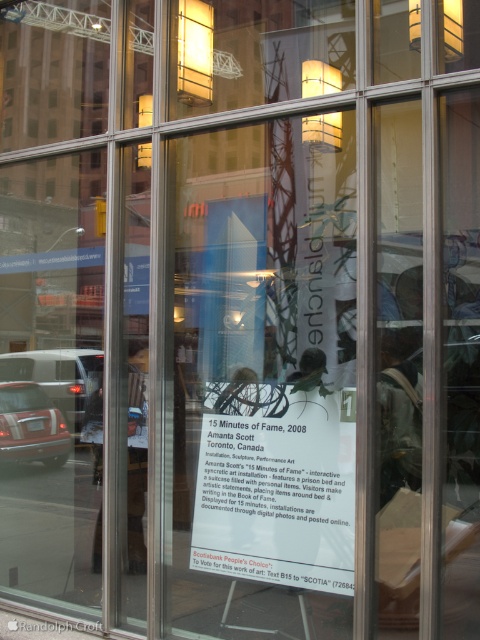
You are standing in front of the glass storefront and notice two points marked on the reflection. The first point is at coordinate (304, 547) and the second at (3, 432). Which point appears closer to you based on their positions in the reflection?

Point (304, 547) is closer to the viewer than point (3, 432).

You are standing in front of the glass storefront and notice two points marked on the reflection. Which point is closer to you, point at (76,422) or point at (25,449)?

Point at (25,449) is closer to you because it is less further to the camera than point at (76,422).

Based on the photo, you are a photographer standing in front of the glass storefront. You want to capture a photo that includes both the white paper at center and the matte black car at lower left. Given the reflection in the glass, can you fit both elements into a single frame without moving your position?

The distance between the white paper at center and the matte black car at lower left is 6.37 meters. Since the photographer cannot move their position, it depends on the camera lens used. However, the question does not provide information about the camera equipment, so it is uncertain. But based on typical smartphone cameras, capturing both elements might be challenging due to the distance.